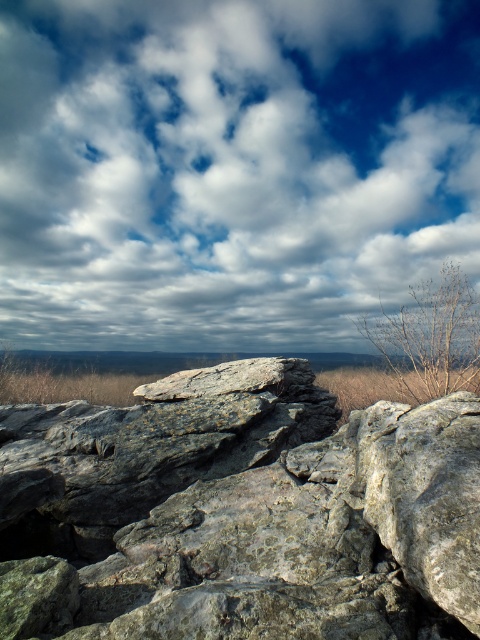
You are standing in the rugged, rocky landscape described. You notice the cloudy sky at upper center and the brown dry grass at right. Which object is positioned to the left of the other?

The cloudy sky at upper center is to the left of the brown dry grass at right.

You are standing in the rugged, rocky landscape shown in the image. You notice a specific point at coordinates point (230,168). What is the object located at this point?

The point (230,168) corresponds to cloudy sky at upper center.